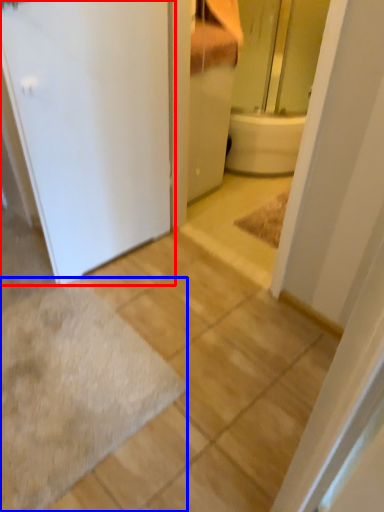
Question: Which of the following is the farthest to the observer, door (highlighted by a red box) or bath mat (highlighted by a blue box)?

Choices:
 (A) door
 (B) bath mat

Answer: (B)